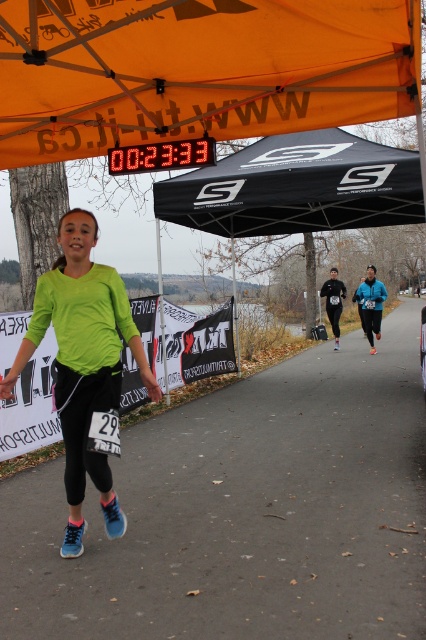
Between point (207, 227) and point (94, 328), which one is positioned behind?

The point (207, 227) is behind.

Based on the photo, can you confirm if black fabric canopy at upper center is bigger than green matte shirt at center?

Yes.

The width and height of the screenshot is (426, 640). Describe the element at coordinates (296, 186) in the screenshot. I see `black fabric canopy at upper center` at that location.

At what (x,y) coordinates should I click in order to perform the action: click on black fabric canopy at upper center. Please return your answer as a coordinate pair (x, y). The width and height of the screenshot is (426, 640). Looking at the image, I should click on (296, 186).

Is orange fabric canopy at upper center thinner than black fabric canopy at upper center?

Incorrect, orange fabric canopy at upper center's width is not less than black fabric canopy at upper center's.

The width and height of the screenshot is (426, 640). What do you see at coordinates (198, 70) in the screenshot? I see `orange fabric canopy at upper center` at bounding box center [198, 70].

Locate an element on the screen. The image size is (426, 640). orange fabric canopy at upper center is located at coordinates (198, 70).

Is point (383, 385) in front of point (232, 205)?

No.

Which is more to the right, green fabric runner at center or black fabric tent at center?

black fabric tent at center is more to the right.

The width and height of the screenshot is (426, 640). What do you see at coordinates (244, 512) in the screenshot?
I see `green fabric runner at center` at bounding box center [244, 512].

The height and width of the screenshot is (640, 426). Find the location of `green fabric runner at center`. green fabric runner at center is located at coordinates (244, 512).